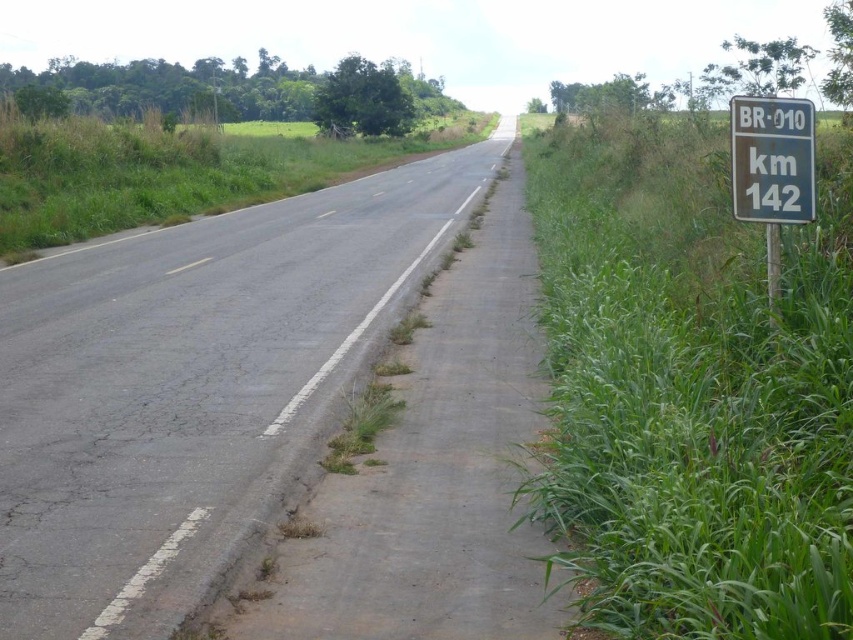
You are driving a car with a width of 2 meters. You need to park your car on the road while avoiding the green grass at right. Is there enough space on the asphalt road at center to park your car?

The asphalt road at center is larger than the green grass at right. Since the car is 2 meters wide, and the asphalt road at center is wider than the green grass, there should be sufficient space to park the car on the asphalt road at center without encroaching on the grass.

You are driving along the BR010 highway and notice two patches of green grass at right and green grass at center. Which one would you see first as you approach the road?

The green grass at right is closer to the viewer than green grass at center, so you would see the green grass at right first as you approach the road.

You are driving a car that is 2.0 meters wide. You need to pull over to the side of the road to let another vehicle pass. The asphalt road at center is currently occupied. Can you safely move your car to the green grass at right without encroaching on the road? Explain your reasoning.

The green grass at right is 5.20 meters away from the asphalt road at center. Since your car is only 2.0 meters wide, there is sufficient space between the asphalt road at center and the green grass at right to safely move the car without encroaching on the road. The distance allows for maneuvering while maintaining a safe distance from the road surface.